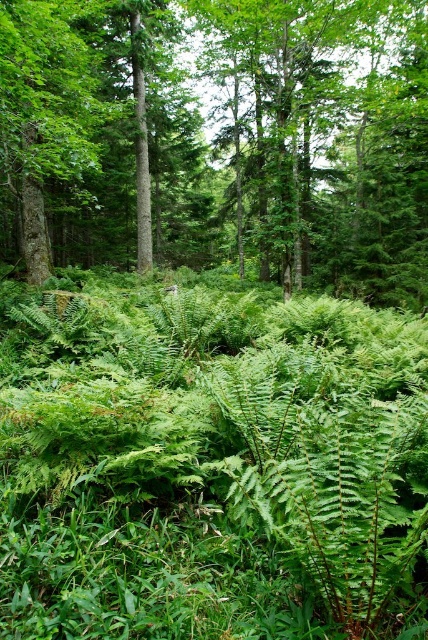
Based on the scene description, where is the green leafy grass at center located in terms of coordinates?

The green leafy grass at center is located at point coordinates of [211,467].

You are navigating through a forest and want to reach a specific point. You see two points marked in the image. Which point is closer to you, point (416,419) or point (35,259)?

Point (416,419) is in front of point (35,259), so it is closer to you.